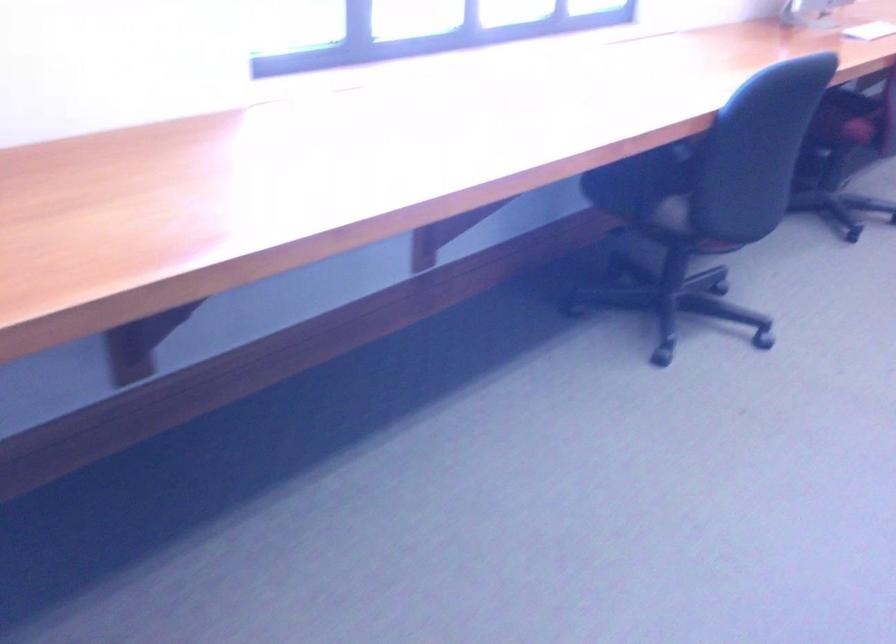
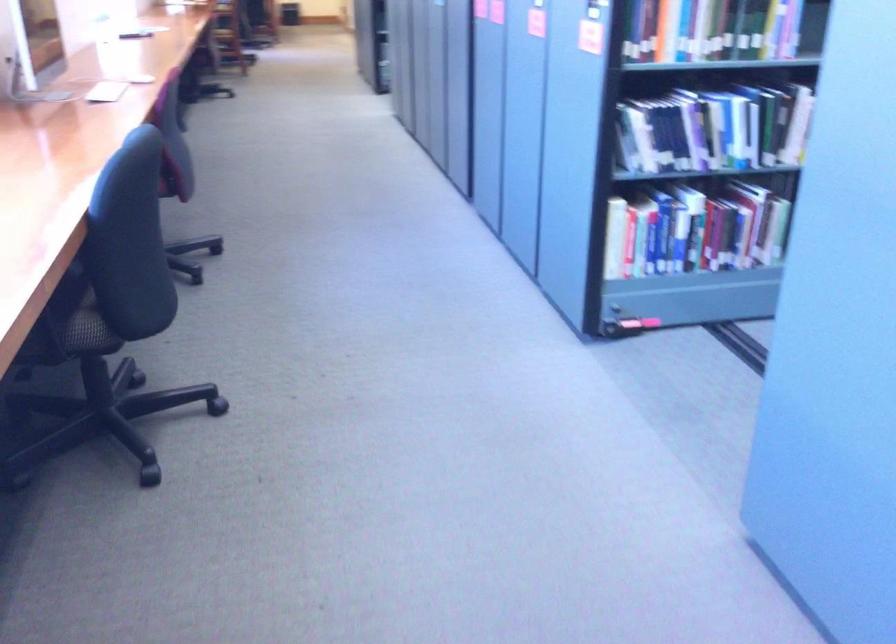
Question: The camera is either moving clockwise (left) or counter-clockwise (right) around the object. The first image is from the beginning of the video and the second image is from the end. Is the camera moving left or right when shooting the video?

Choices:
 (A) Left
 (B) Right

Answer: (A)